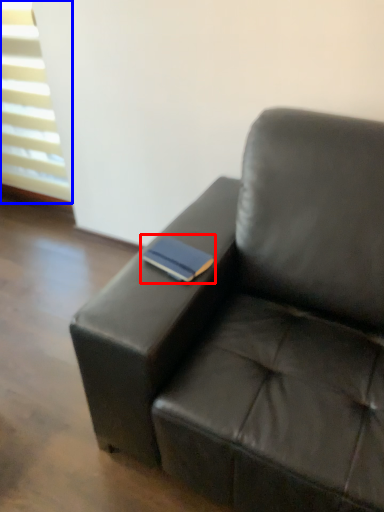
Question: Which object is closer to the camera taking this photo, paperback book (highlighted by a red box) or window (highlighted by a blue box)?

Choices:
 (A) paperback book
 (B) window

Answer: (A)